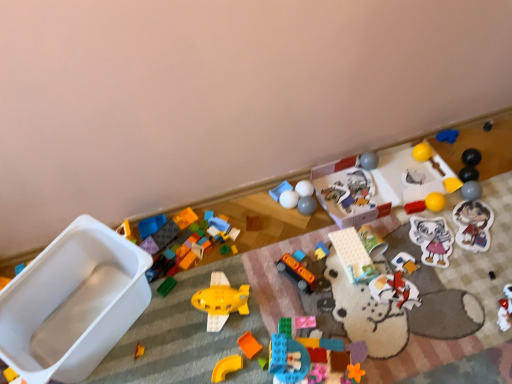
Where is `empty space that is in between rubber duck at center, which ranks as the eleventh toy in right-to-left order, and yellow plastic curve at center, the fifth toy in the left-to-right sequence`? empty space that is in between rubber duck at center, which ranks as the eleventh toy in right-to-left order, and yellow plastic curve at center, the fifth toy in the left-to-right sequence is located at coordinates (270, 317).